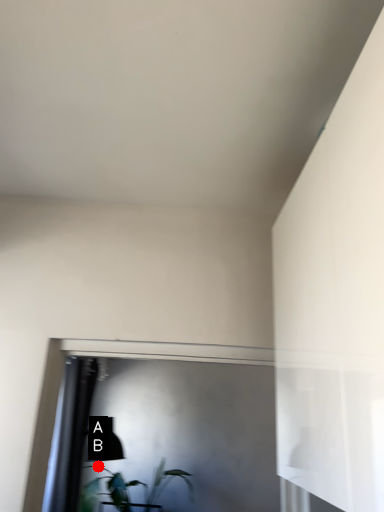
Question: Two points are circled on the image, labeled by A and B beside each circle. Which of the following is the farthest from the observer?

Choices:
 (A) A is further
 (B) B is further

Answer: (A)